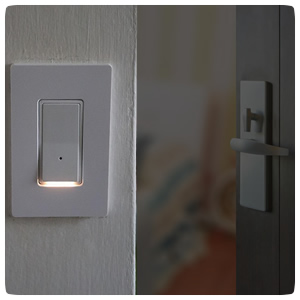
Identify the location of light switch cover. (68, 81).